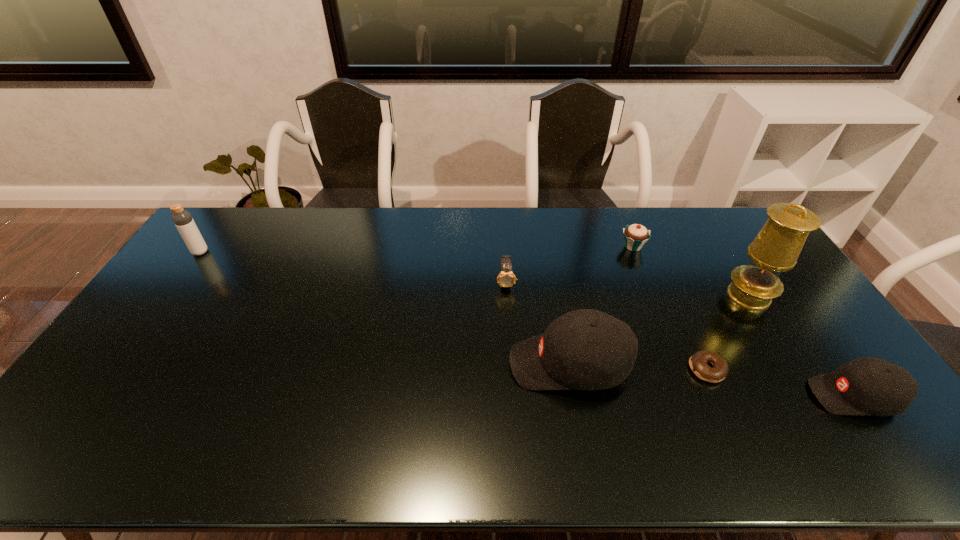
This screenshot has width=960, height=540. Identify the location of object that stands as the third closest to the right baseball cap. (585, 349).

The height and width of the screenshot is (540, 960). What are the coordinates of `vacant space that satisfies the following two spatial constraints: 1. on the face of the doughnut; 2. on the right side of the watch` in the screenshot? It's located at (512, 369).

Locate an element on the screen. The height and width of the screenshot is (540, 960). free space that satisfies the following two spatial constraints: 1. on the face of the doughnut; 2. on the right side of the watch is located at coordinates (512, 369).

Identify the location of free point that satisfies the following two spatial constraints: 1. on the front side of the doughnut; 2. on the right side of the leftmost object. The image size is (960, 540). (116, 369).